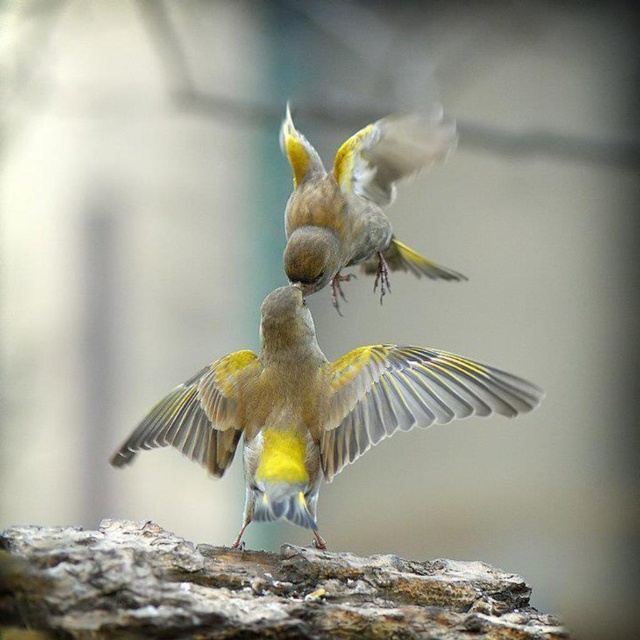
The image size is (640, 640). What do you see at coordinates (312, 408) in the screenshot?
I see `yellow-green feathers at center` at bounding box center [312, 408].

What do you see at coordinates (312, 408) in the screenshot? The height and width of the screenshot is (640, 640). I see `yellow-green feathers at center` at bounding box center [312, 408].

Where is `yellow-green feathers at center`? yellow-green feathers at center is located at coordinates (312, 408).